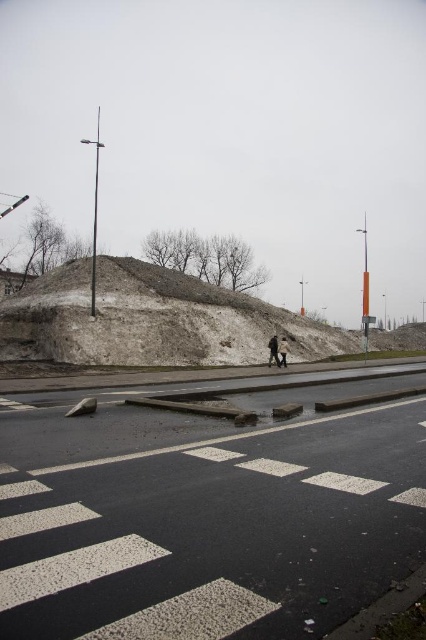
Question: Is gray textured dirt at center wider than light brown leather jacket at center?

Choices:
 (A) yes
 (B) no

Answer: (A)

Question: Observing the image, what is the correct spatial positioning of gray textured dirt at center in reference to light brown leather jacket at center?

Choices:
 (A) above
 (B) below

Answer: (A)

Question: Among these objects, which one is nearest to the camera?

Choices:
 (A) gray textured dirt at center
 (B) dark gray fabric coat at center

Answer: (A)

Question: Which object is closer to the camera taking this photo?

Choices:
 (A) gray textured dirt at center
 (B) light brown leather jacket at center

Answer: (A)

Question: Which point is closer to the camera?

Choices:
 (A) gray textured dirt at center
 (B) light brown leather jacket at center
 (C) dark gray fabric coat at center

Answer: (A)

Question: Does gray textured dirt at center appear on the left side of light brown leather jacket at center?

Choices:
 (A) yes
 (B) no

Answer: (B)